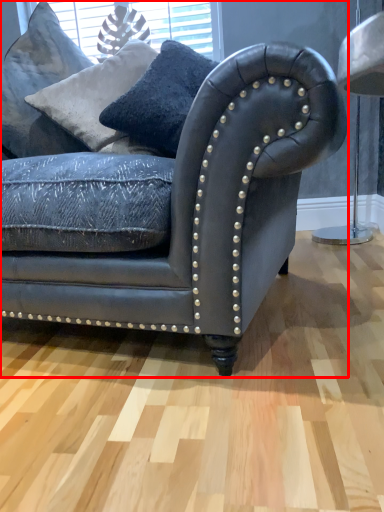
Question: Considering the relative positions of studio couch (annotated by the red box) and pillow in the image provided, where is studio couch (annotated by the red box) located with respect to the staircase?

Choices:
 (A) right
 (B) left

Answer: (A)